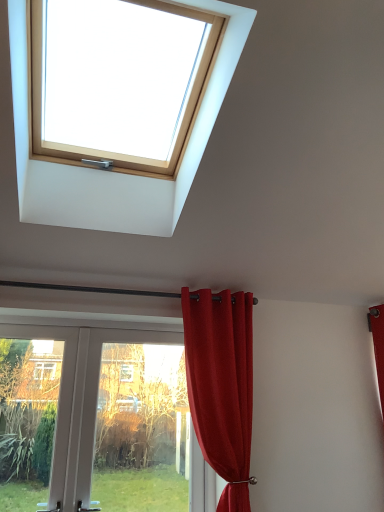
You are a GUI agent. You are given a task and a screenshot of the screen. Output one action in this format:
    pyautogui.click(x=<x>, y=<y>)
    Task: Click on the free space above transparent glass door at lower left (from a real-world perspective)
    This screenshot has height=512, width=384.
    Given the screenshot: What is the action you would take?
    pyautogui.click(x=142, y=326)